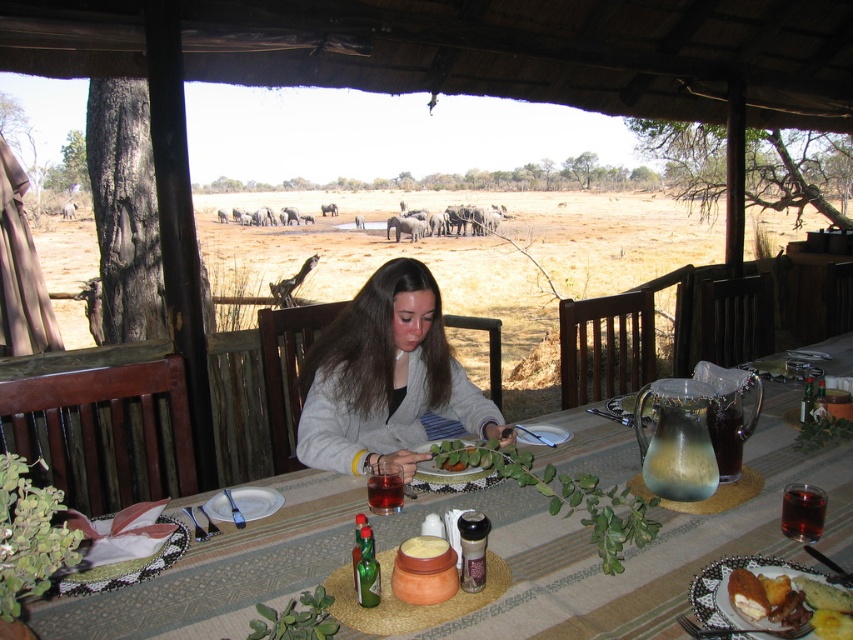
Is white ceramic plate at lower left closer to camera compared to yellow matte bowl at center?

No, it is behind yellow matte bowl at center.

Is white ceramic plate at lower left behind yellow matte bowl at center?

Yes, white ceramic plate at lower left is further from the viewer.

Does point (230, 513) lie in front of point (447, 550)?

No, (230, 513) is further to viewer.

What are the coordinates of `white ceramic plate at lower left` in the screenshot? It's located at (242, 502).

Is light gray fleece at center wider than yellow matte bowl at center?

Indeed, light gray fleece at center has a greater width compared to yellow matte bowl at center.

Between point (418, 440) and point (412, 550), which one is positioned behind?

The point (418, 440) is more distant.

Locate an element on the screen. This screenshot has width=853, height=640. light gray fleece at center is located at coordinates (386, 378).

Can you confirm if matte glass pitcher at center is thinner than golden brown bread at center?

No.

Can you confirm if matte glass pitcher at center is wider than golden brown bread at center?

Yes, matte glass pitcher at center is wider than golden brown bread at center.

Is point (643, 624) behind point (802, 621)?

Yes, point (643, 624) is behind point (802, 621).

Where is `matte glass pitcher at center`? This screenshot has width=853, height=640. matte glass pitcher at center is located at coordinates (631, 548).